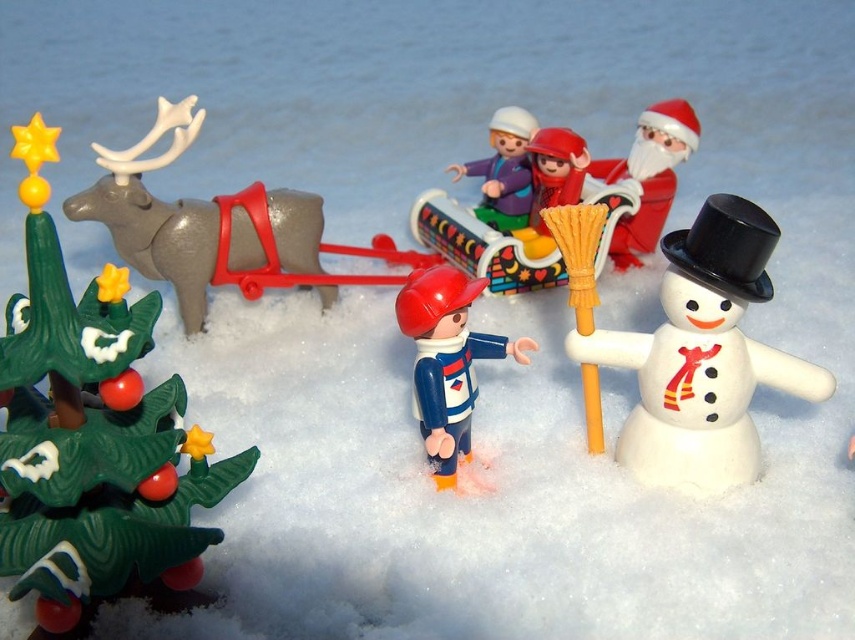
Question: Is white matte snowman at right positioned before white matte santa at upper right?

Choices:
 (A) yes
 (B) no

Answer: (A)

Question: Does blue plastic figure at center lie in front of smooth plastic sleigh at center?

Choices:
 (A) no
 (B) yes

Answer: (B)

Question: Which point is farther to the camera?

Choices:
 (A) pyautogui.click(x=19, y=378)
 (B) pyautogui.click(x=83, y=204)
 (C) pyautogui.click(x=511, y=173)

Answer: (C)

Question: Which point is closer to the camera?

Choices:
 (A) (629, 170)
 (B) (486, 168)
 (C) (103, 472)
 (D) (730, 428)

Answer: (C)

Question: Estimate the real-world distances between objects in this image. Which object is closer to the gray matte reindeer at left?

Choices:
 (A) white matte santa at upper right
 (B) smooth plastic sleigh at center
 (C) white matte snowman at right
 (D) blue plastic figure at center

Answer: (B)

Question: Does green plastic christmas tree at left have a smaller size compared to white matte santa at upper right?

Choices:
 (A) yes
 (B) no

Answer: (B)